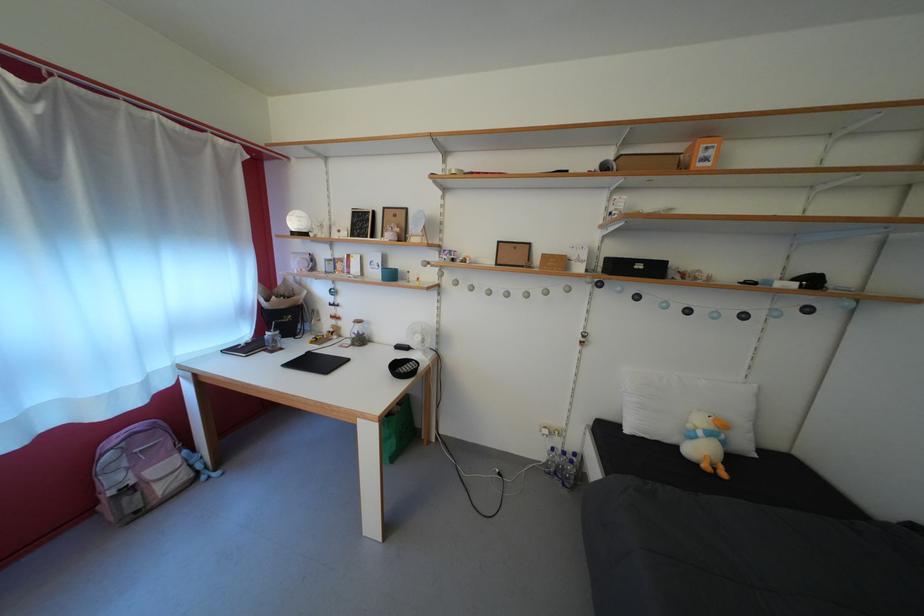
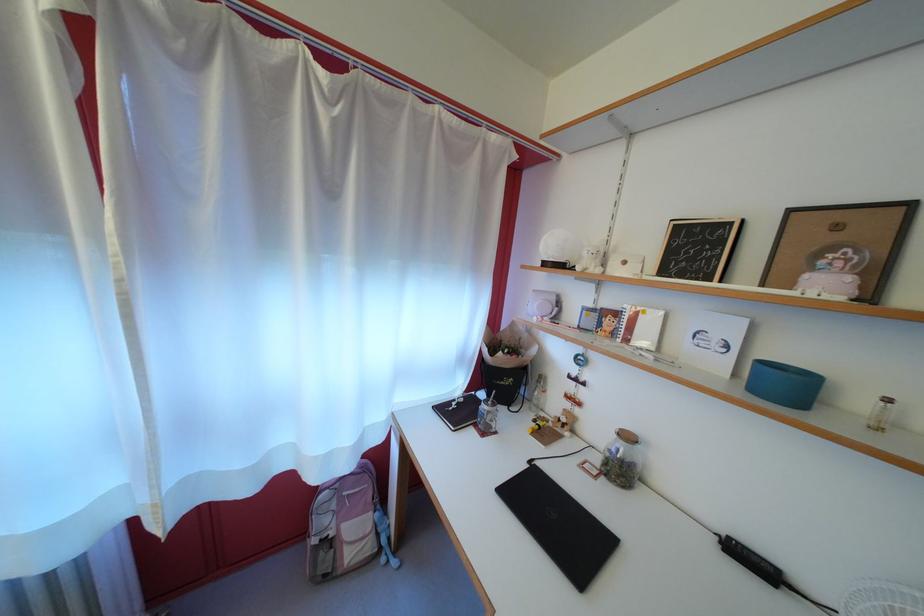
Question: The camera is either moving clockwise (left) or counter-clockwise (right) around the object. The first image is from the beginning of the video and the second image is from the end. Is the camera moving left or right when shooting the video?

Choices:
 (A) Left
 (B) Right

Answer: (B)